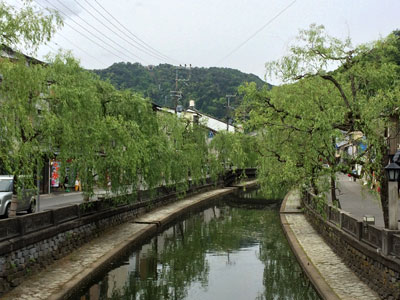
Image resolution: width=400 pixels, height=300 pixels. In order to click on lamp in this screenshot , I will do (393, 178).